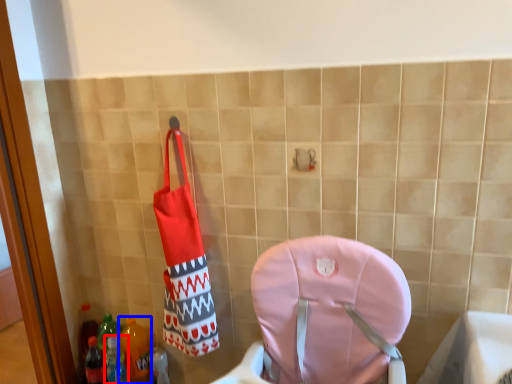
Question: Which object appears closest to the camera in this image, bottle (highlighted by a red box) or bottle (highlighted by a blue box)?

Choices:
 (A) bottle
 (B) bottle

Answer: (A)